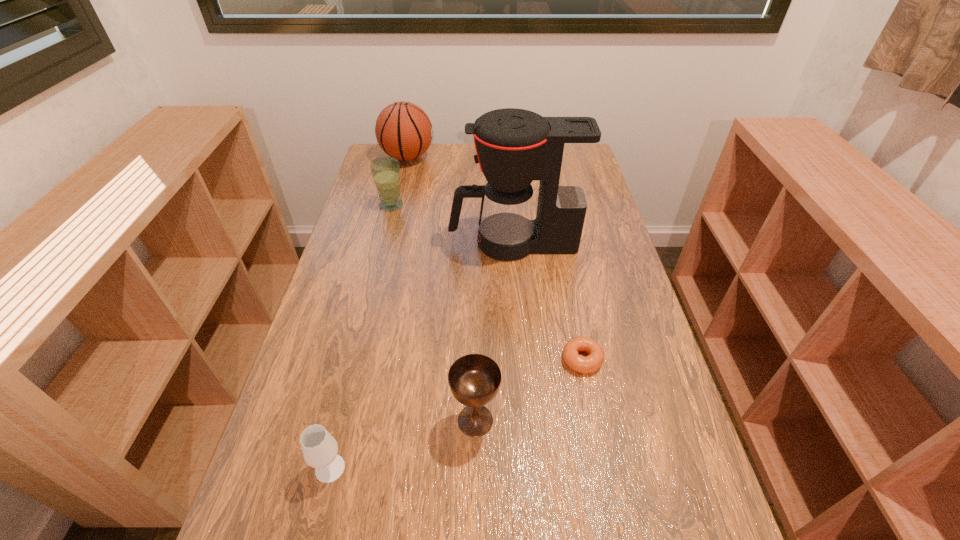
Identify the location of basketball present at the left edge. (403, 130).

At what (x,y) coordinates should I click in order to perform the action: click on coffee maker that is at the right edge. Please return your answer as a coordinate pair (x, y). The width and height of the screenshot is (960, 540). Looking at the image, I should click on (514, 146).

Where is `doughnut that is at the right edge`? doughnut that is at the right edge is located at coordinates (591, 363).

This screenshot has width=960, height=540. I want to click on object that is at the far left corner, so click(403, 130).

Find the location of `vacant area at the far edge of the desktop`. vacant area at the far edge of the desktop is located at coordinates (459, 144).

In the image, there is a desktop. Identify the location of blank space at the left edge. (361, 313).

Identify the location of free region at the right edge of the desktop. This screenshot has width=960, height=540. (665, 497).

Find the location of a particular element. The width and height of the screenshot is (960, 540). vacant area that lies between the chalice and the fourth nearest object is located at coordinates (494, 332).

Find the location of a particular element. Image resolution: width=960 pixels, height=540 pixels. vacant point located between the nearer glass and the second tallest object is located at coordinates (369, 313).

At what (x,y) coordinates should I click in order to perform the action: click on empty space that is in between the tallest object and the nearest object. Please return your answer as a coordinate pair (x, y). This screenshot has height=540, width=960. Looking at the image, I should click on (421, 356).